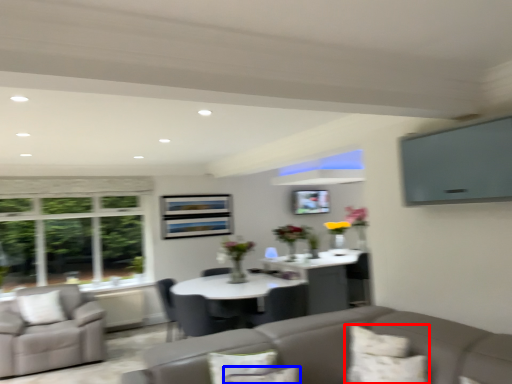
Question: Which of the following is the farthest to the observer, pillow (highlighted by a red box) or pillow (highlighted by a blue box)?

Choices:
 (A) pillow
 (B) pillow

Answer: (A)